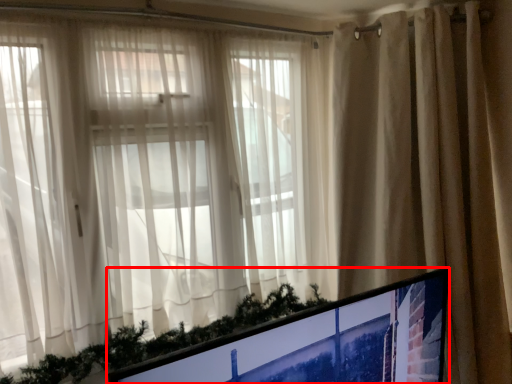
Question: Observing the image, what is the correct spatial positioning of computer monitor (annotated by the red box) in reference to curtain?

Choices:
 (A) right
 (B) left

Answer: (B)